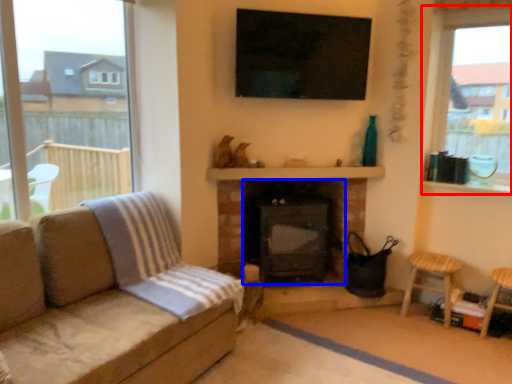
Question: Which object appears farthest to the camera in this image, window (highlighted by a red box) or fireplace (highlighted by a blue box)?

Choices:
 (A) window
 (B) fireplace

Answer: (B)